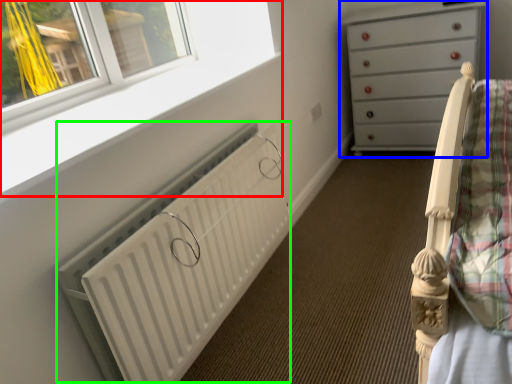
Question: Based on their relative distances, which object is farther from window frame (highlighted by a red box)? Choose from chest of drawers (highlighted by a blue box) and radiator (highlighted by a green box).

Choices:
 (A) chest of drawers
 (B) radiator

Answer: (A)